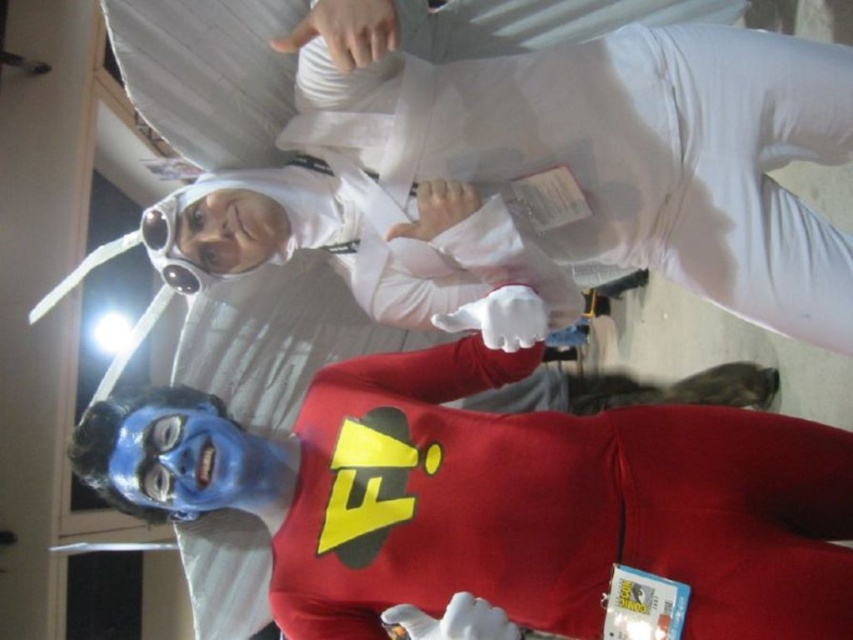
Which is more to the left, white fabric costume at upper center or matte plastic goggles at upper left?

From the viewer's perspective, matte plastic goggles at upper left appears more on the left side.

Between point (720, 147) and point (177, 220), which one is positioned behind?

Positioned behind is point (177, 220).

The image size is (853, 640). I want to click on white fabric costume at upper center, so click(648, 154).

Is blue matte face paint at lower left bigger than matte plastic goggles at upper left?

Indeed, blue matte face paint at lower left has a larger size compared to matte plastic goggles at upper left.

Does blue matte face paint at lower left have a smaller size compared to matte plastic goggles at upper left?

Incorrect, blue matte face paint at lower left is not smaller in size than matte plastic goggles at upper left.

Does point (634, 506) come closer to viewer compared to point (165, 257)?

Yes, it is.

In order to click on blue matte face paint at lower left in this screenshot , I will do `click(502, 499)`.

Is blue matte face paint at lower left to the right of white fabric costume at upper center from the viewer's perspective?

In fact, blue matte face paint at lower left is to the left of white fabric costume at upper center.

Which is above, blue matte face paint at lower left or white fabric costume at upper center?

white fabric costume at upper center

Is point (306, 403) positioned before point (679, 140)?

No, (306, 403) is further to viewer.

This screenshot has width=853, height=640. I want to click on blue matte face paint at lower left, so click(x=502, y=499).